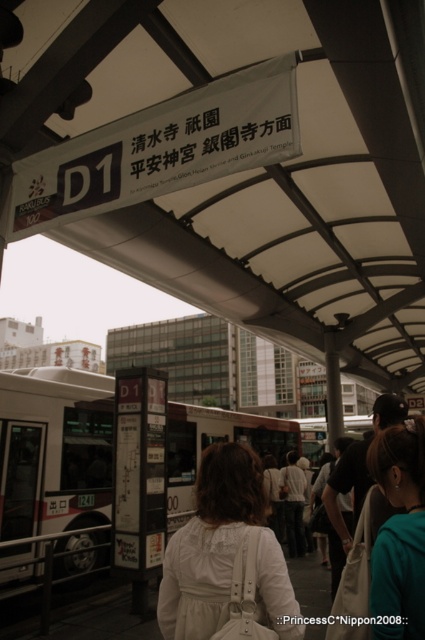
Between white plastic bus at center and teal fabric hair at center, which one is positioned lower?

white plastic bus at center is lower down.

Who is taller, white plastic bus at center or teal fabric hair at center?

With more height is white plastic bus at center.

Does point (8, 413) lie in front of point (382, 588)?

No, it is behind (382, 588).

The height and width of the screenshot is (640, 425). What are the coordinates of `white plastic bus at center` in the screenshot? It's located at (53, 472).

Can you confirm if white plastic bus at center is bigger than white fabric dress at center?

Correct, white plastic bus at center is larger in size than white fabric dress at center.

Does white plastic bus at center have a smaller size compared to white fabric dress at center?

No, white plastic bus at center is not smaller than white fabric dress at center.

The width and height of the screenshot is (425, 640). Identify the location of white plastic bus at center. (53, 472).

Does white fabric dress at center have a larger size compared to teal fabric hair at center?

Yes.

Who is more forward, (192,605) or (422,444)?

Point (422,444) is more forward.

Between point (268, 541) and point (411, 422), which one is positioned behind?

Point (411, 422)

You are a GUI agent. You are given a task and a screenshot of the screen. Output one action in this format:
    pyautogui.click(x=<x>, y=<y>)
    Task: Click on the white fabric dress at center
    
    Given the screenshot: What is the action you would take?
    click(223, 552)